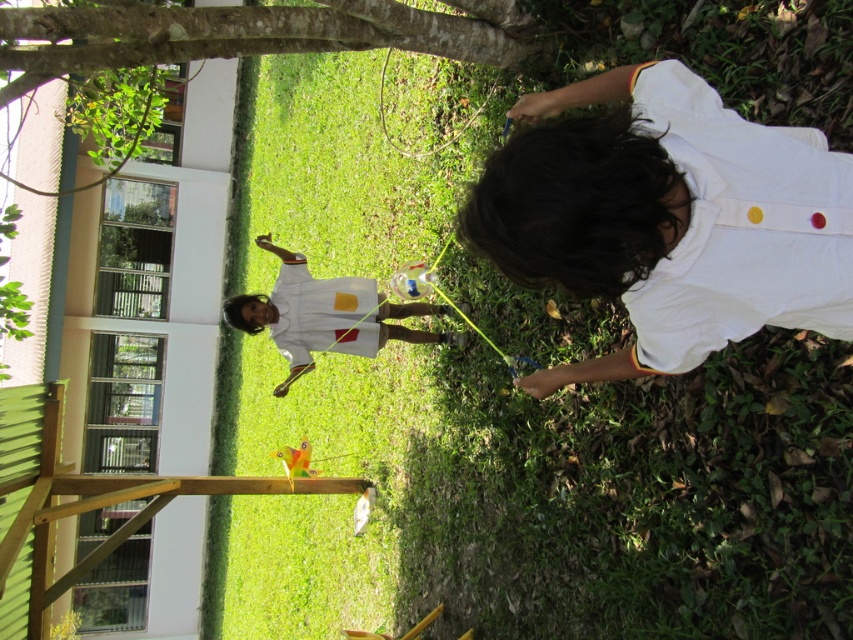
Which is in front, point (288, 116) or point (389, 308)?

Point (389, 308) is more forward.

From the picture: Can you confirm if green grass at center is bigger than white matte shirt at center?

Indeed, green grass at center has a larger size compared to white matte shirt at center.

Measure the distance between green grass at center and camera.

A distance of 2.87 meters exists between green grass at center and camera.

Where is `green grass at center`? The width and height of the screenshot is (853, 640). green grass at center is located at coordinates (543, 497).

Does point (757, 152) lie behind point (332, 280)?

That is False.

Between point (540, 252) and point (335, 294), which one is positioned behind?

The point (335, 294) is behind.

Find the location of a particular element. The width and height of the screenshot is (853, 640). white cotton shirt at center is located at coordinates (668, 220).

Between green grass at center and white cotton shirt at center, which one appears on the left side from the viewer's perspective?

Positioned to the left is green grass at center.

Measure the distance between green grass at center and white cotton shirt at center.

green grass at center is 9.52 feet away from white cotton shirt at center.

Is point (843, 436) positioned in front of point (651, 145)?

No, it is behind (651, 145).

The height and width of the screenshot is (640, 853). Find the location of `green grass at center`. green grass at center is located at coordinates (543, 497).